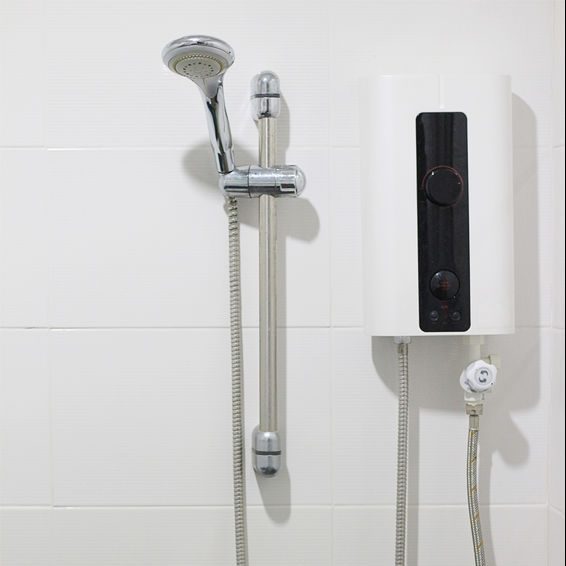
The image size is (566, 566). In order to click on shower head in this screenshot , I will do `click(186, 47)`.